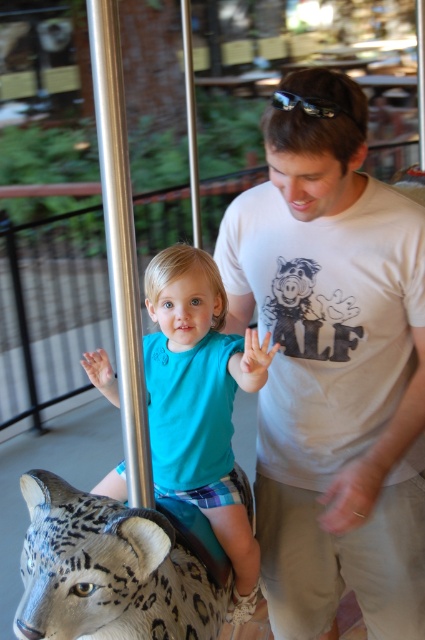
How distant is white cotton t-shirt at center from teal matte shirt at center?

A distance of 8.59 inches exists between white cotton t-shirt at center and teal matte shirt at center.

Does white cotton t-shirt at center have a larger size compared to teal matte shirt at center?

Yes, white cotton t-shirt at center is bigger than teal matte shirt at center.

Locate an element on the screen. Image resolution: width=425 pixels, height=640 pixels. white cotton t-shirt at center is located at coordinates (333, 365).

Image resolution: width=425 pixels, height=640 pixels. In order to click on white cotton t-shirt at center in this screenshot , I will do `click(333, 365)`.

Is point (303, 80) behind point (133, 532)?

That is True.

Between white cotton t-shirt at center and leopard statue at center, which one has less height?

With less height is leopard statue at center.

The height and width of the screenshot is (640, 425). Identify the location of white cotton t-shirt at center. (333, 365).

Where is `white cotton t-shirt at center`? This screenshot has height=640, width=425. white cotton t-shirt at center is located at coordinates (333, 365).

Who is positioned more to the right, leopard statue at center or teal matte shirt at center?

teal matte shirt at center is more to the right.

Who is higher up, leopard statue at center or teal matte shirt at center?

teal matte shirt at center

Which is in front, point (178, 508) or point (158, 380)?

Point (178, 508) is in front.

This screenshot has height=640, width=425. Find the location of `leopard statue at center`. leopard statue at center is located at coordinates (116, 566).